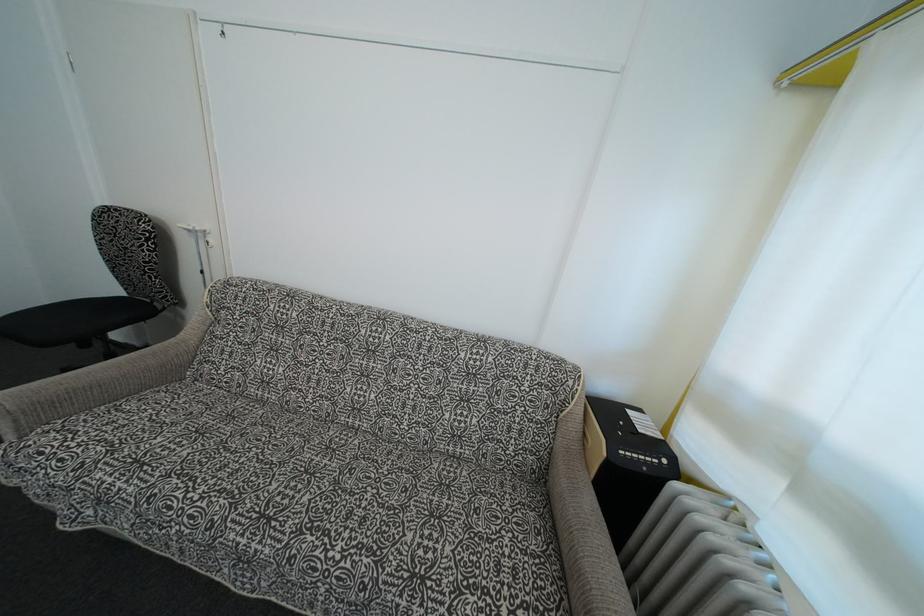
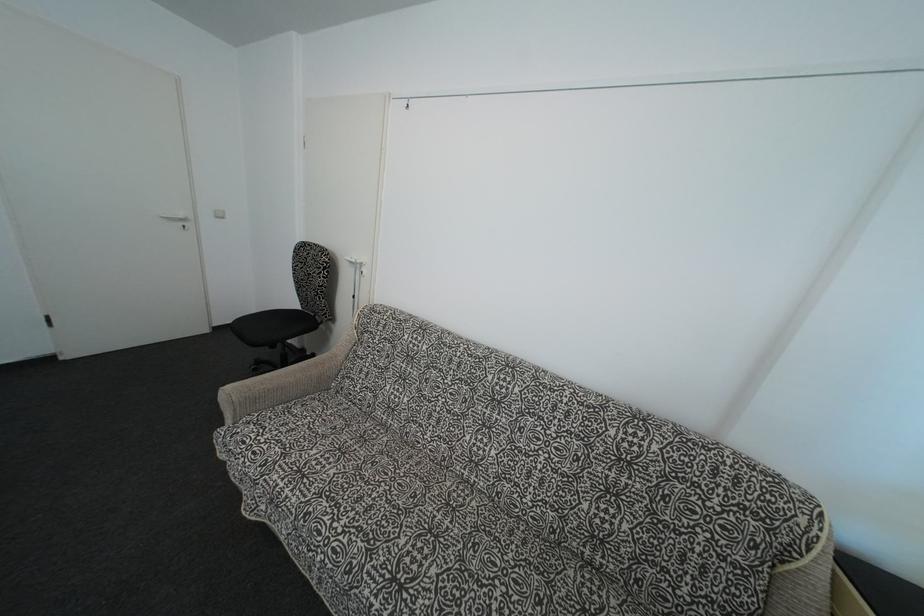
In the second image, find the point that corresponds to (116,296) in the first image.

(297, 310)